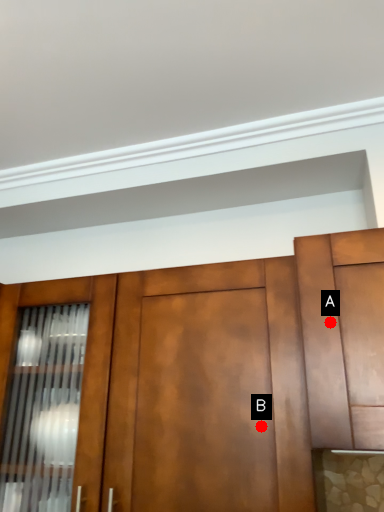
Question: Two points are circled on the image, labeled by A and B beside each circle. Which of the following is the farthest from the observer?

Choices:
 (A) A is further
 (B) B is further

Answer: (B)